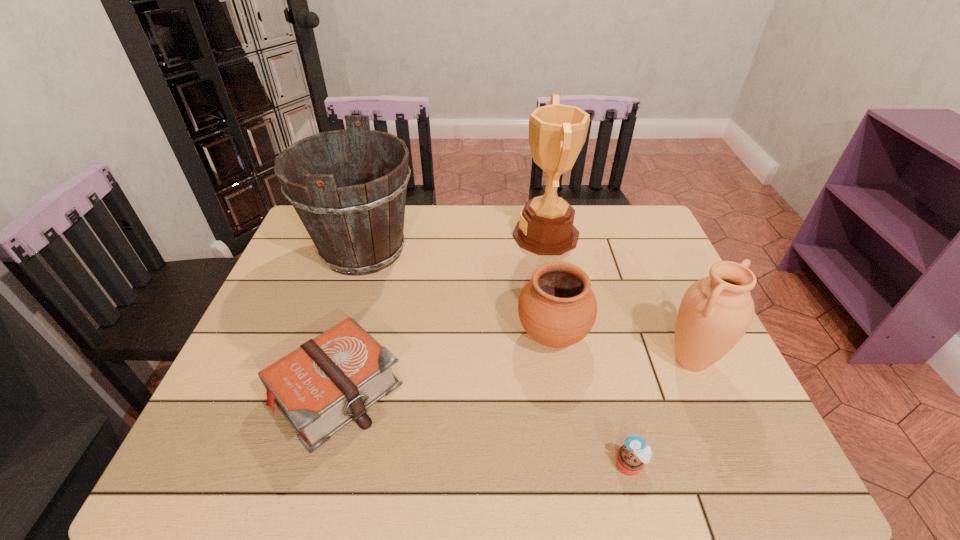
The image size is (960, 540). What are the coordinates of `free space between the fourth tallest object and the shortest object` in the screenshot? It's located at (591, 400).

Locate an element on the screen. free point between the pottery and the urn is located at coordinates (622, 348).

This screenshot has height=540, width=960. Identify the location of empty space between the urn and the shortest object. (660, 413).

Locate an element on the screen. This screenshot has width=960, height=540. empty space that is in between the second tallest object and the pottery is located at coordinates (458, 293).

I want to click on empty location between the award and the Bible, so click(x=441, y=313).

Locate an element on the screen. This screenshot has height=540, width=960. unoccupied area between the third shortest object and the shortest object is located at coordinates (591, 400).

Find the location of a particular element. The image size is (960, 540). vacant area between the shortest object and the Bible is located at coordinates (483, 428).

Locate an element on the screen. The width and height of the screenshot is (960, 540). object that stands as the closest to the urn is located at coordinates (557, 308).

Locate which object ranks second in proximity to the fourth shortest object. Please provide its 2D coordinates. Your answer should be formatted as a tuple, i.e. [(x, y)], where the tuple contains the x and y coordinates of a point satisfying the conditions above.

[(631, 457)]

Find the location of a particular element. Image resolution: width=960 pixels, height=540 pixels. free spot that satisfies the following two spatial constraints: 1. on the back side of the fourth shortest object; 2. on the right side of the Bible is located at coordinates (345, 361).